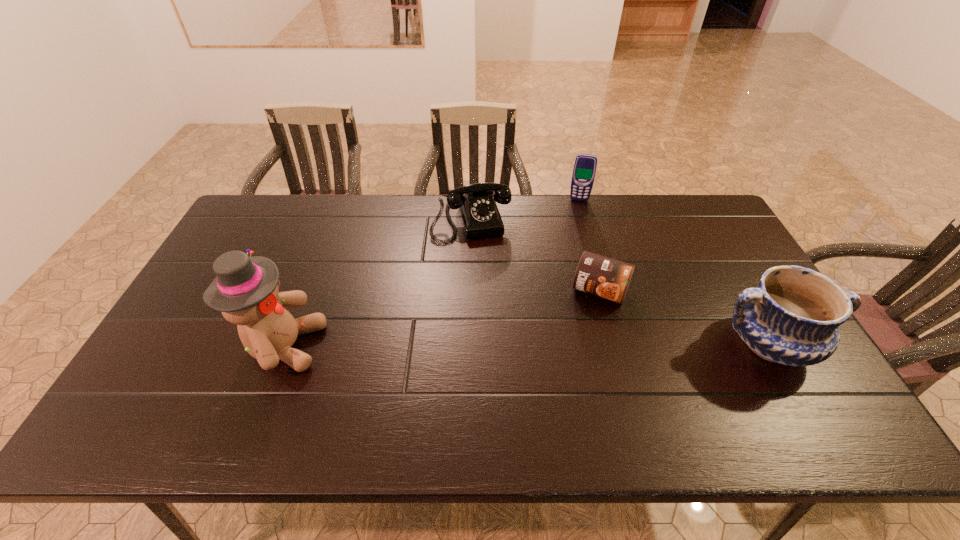
Where is `the third closest object to the rightmost object`? The image size is (960, 540). the third closest object to the rightmost object is located at coordinates (480, 217).